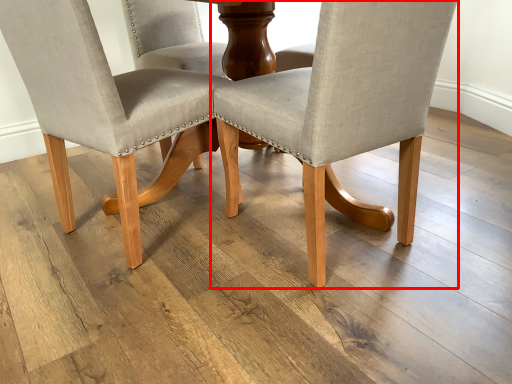
Question: From the image's perspective, what is the correct spatial positioning of chair (annotated by the red box) in reference to chair?

Choices:
 (A) above
 (B) below

Answer: (B)